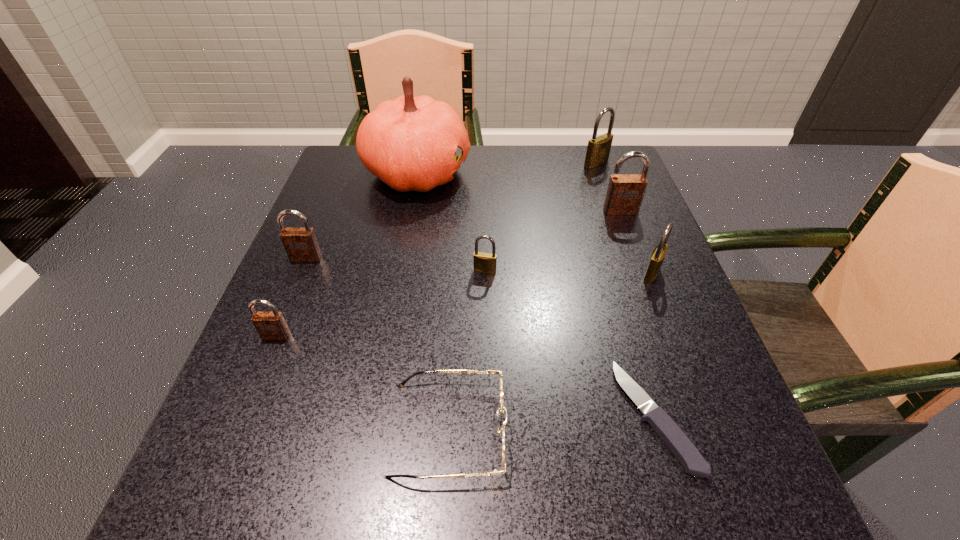
In the image, there is a desktop. At what (x,y) coordinates should I click in order to perform the action: click on vacant space at the near right corner. Please return your answer as a coordinate pair (x, y). The image size is (960, 540). Looking at the image, I should click on (683, 472).

Locate an element on the screen. The image size is (960, 540). free space between the smallest brass padlock and the seventh farthest object is located at coordinates (380, 303).

Where is `blank region between the second biggest brass padlock and the farthest padlock`? This screenshot has height=540, width=960. blank region between the second biggest brass padlock and the farthest padlock is located at coordinates click(624, 219).

Where is `free spot between the fourth farthest object and the farthest padlock`? free spot between the fourth farthest object and the farthest padlock is located at coordinates (451, 211).

The image size is (960, 540). I want to click on free space between the second smallest brass padlock and the eighth tallest object, so click(x=550, y=352).

The width and height of the screenshot is (960, 540). What are the coordinates of `vacant area that lies between the second biggest brass padlock and the tallest object` in the screenshot? It's located at (535, 223).

Locate an element on the screen. The image size is (960, 540). free area in between the biggest brass padlock and the pink pumpkin is located at coordinates (507, 168).

The image size is (960, 540). Find the location of `vacant area between the leftmost brass padlock and the rightmost brown padlock`. vacant area between the leftmost brass padlock and the rightmost brown padlock is located at coordinates (553, 241).

Where is `free space between the smallest brown padlock and the third padlock from left to right`? The height and width of the screenshot is (540, 960). free space between the smallest brown padlock and the third padlock from left to right is located at coordinates (380, 303).

This screenshot has height=540, width=960. I want to click on vacant area between the nearest brown padlock and the second biggest brown padlock, so click(x=291, y=297).